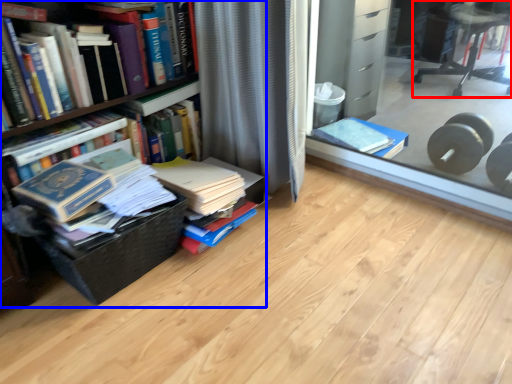
Question: Which object appears farthest to the camera in this image, chair (highlighted by a red box) or bookcase (highlighted by a blue box)?

Choices:
 (A) chair
 (B) bookcase

Answer: (A)